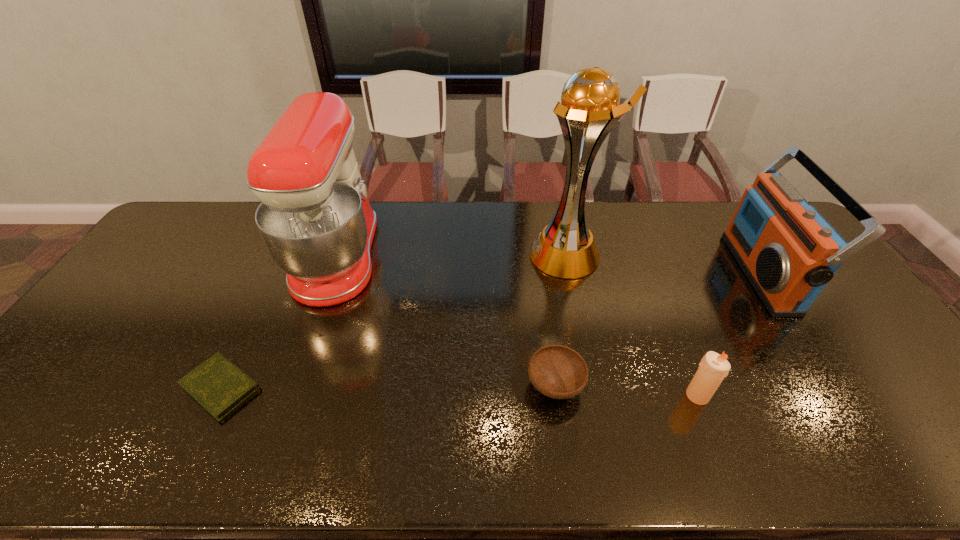
Find the location of a particular element. the tallest object is located at coordinates (589, 109).

The image size is (960, 540). What are the coordinates of `the second tallest object` in the screenshot? It's located at (315, 219).

Where is `radio receiver`? The image size is (960, 540). radio receiver is located at coordinates (788, 251).

The width and height of the screenshot is (960, 540). Find the location of `the rightmost object`. the rightmost object is located at coordinates (788, 251).

Where is `candle`? candle is located at coordinates (713, 368).

Locate an element on the screen. The width and height of the screenshot is (960, 540). the second object from right to left is located at coordinates (713, 368).

This screenshot has height=540, width=960. In order to click on the second shortest object in this screenshot , I will do `click(559, 372)`.

This screenshot has width=960, height=540. Identify the location of the shortest object. (218, 385).

Find the location of `free spot located on the front-facing side of the tallest object`. free spot located on the front-facing side of the tallest object is located at coordinates (450, 255).

This screenshot has width=960, height=540. What are the coordinates of `free space located 0.150m on the front-facing side of the tallest object` in the screenshot? It's located at (484, 255).